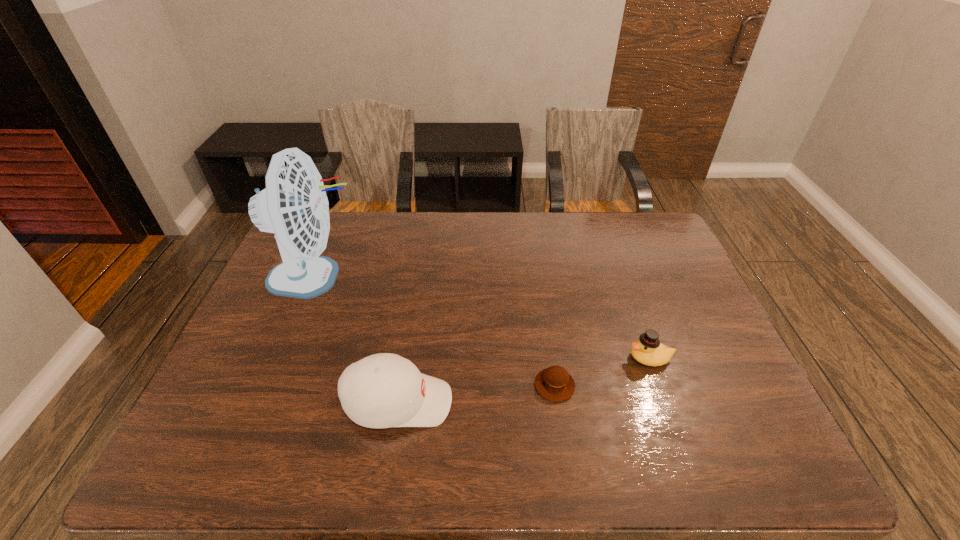
Where is `free space located 0.200m on the front-facing side of the third tallest object`? The height and width of the screenshot is (540, 960). free space located 0.200m on the front-facing side of the third tallest object is located at coordinates (550, 358).

Identify the location of free space located 0.330m on the front-facing side of the third tallest object. (499, 358).

In order to click on vacant space positioned on the front-facing side of the third tallest object in this screenshot , I will do `click(516, 358)`.

You are a GUI agent. You are given a task and a screenshot of the screen. Output one action in this format:
    pyautogui.click(x=<x>, y=<y>)
    Task: Click on the free space located on the front of the second object from right to left
    The image size is (960, 540).
    Given the screenshot: What is the action you would take?
    pyautogui.click(x=567, y=470)

Where is `object that is at the far edge`? The width and height of the screenshot is (960, 540). object that is at the far edge is located at coordinates (294, 205).

At what (x,y) coordinates should I click in order to perform the action: click on object located at the near edge. Please return your answer as a coordinate pair (x, y). Looking at the image, I should click on (383, 390).

Where is `object at the left edge`? object at the left edge is located at coordinates (294, 205).

The width and height of the screenshot is (960, 540). I want to click on object at the right edge, so click(x=648, y=350).

Locate an element on the screen. object located in the far left corner section of the desktop is located at coordinates (294, 205).

This screenshot has width=960, height=540. Find the location of `vacant space at the far edge of the desktop`. vacant space at the far edge of the desktop is located at coordinates (550, 249).